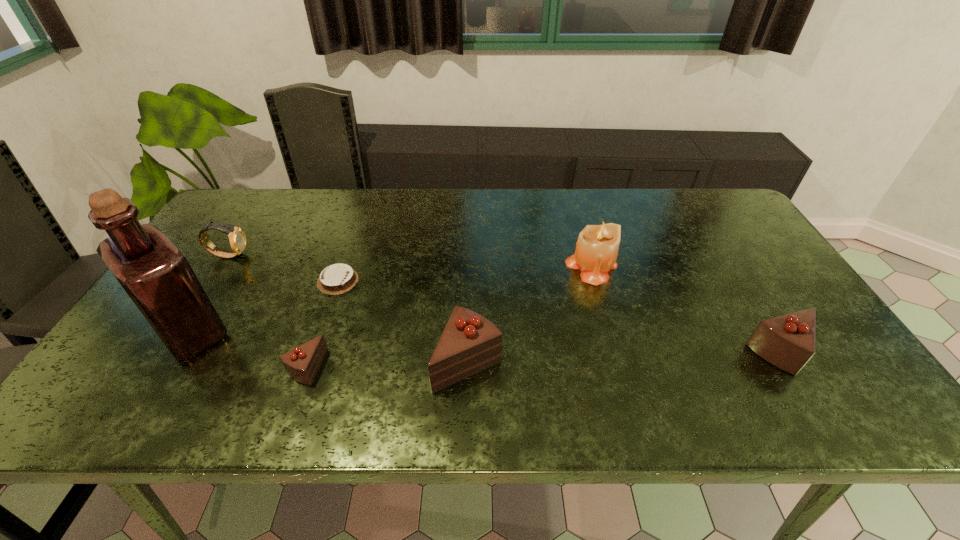
Locate an element on the screen. The width and height of the screenshot is (960, 540). the closest chocolate cake to the sixth tallest object is located at coordinates (338, 278).

Point out which chocolate cake is positioned as the second nearest to the tallest object. Please provide its 2D coordinates. Your answer should be formatted as a tuple, i.e. [(x, y)], where the tuple contains the x and y coordinates of a point satisfying the conditions above.

[(302, 363)]

Where is `vacant space that satisfies the following two spatial constraints: 1. on the face of the watch; 2. on the right side of the sixth shortest object`? The width and height of the screenshot is (960, 540). vacant space that satisfies the following two spatial constraints: 1. on the face of the watch; 2. on the right side of the sixth shortest object is located at coordinates 222,266.

The width and height of the screenshot is (960, 540). I want to click on vacant area that satisfies the following two spatial constraints: 1. on the back side of the third chocolate cake from left to right; 2. on the face of the watch, so click(470, 255).

Locate an element on the screen. The image size is (960, 540). free space that satisfies the following two spatial constraints: 1. on the face of the watch; 2. on the right side of the shortest object is located at coordinates (212, 281).